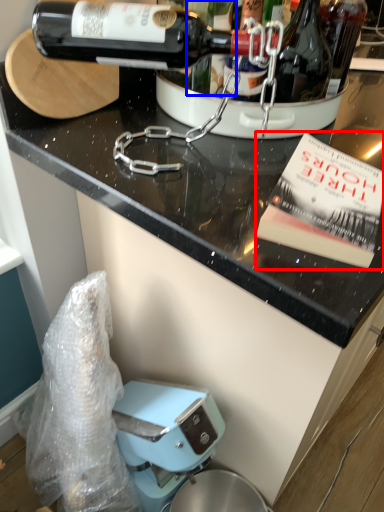
Question: Which of the following is the closest to the observer, paperback book (highlighted by a red box) or wine (highlighted by a blue box)?

Choices:
 (A) paperback book
 (B) wine

Answer: (A)